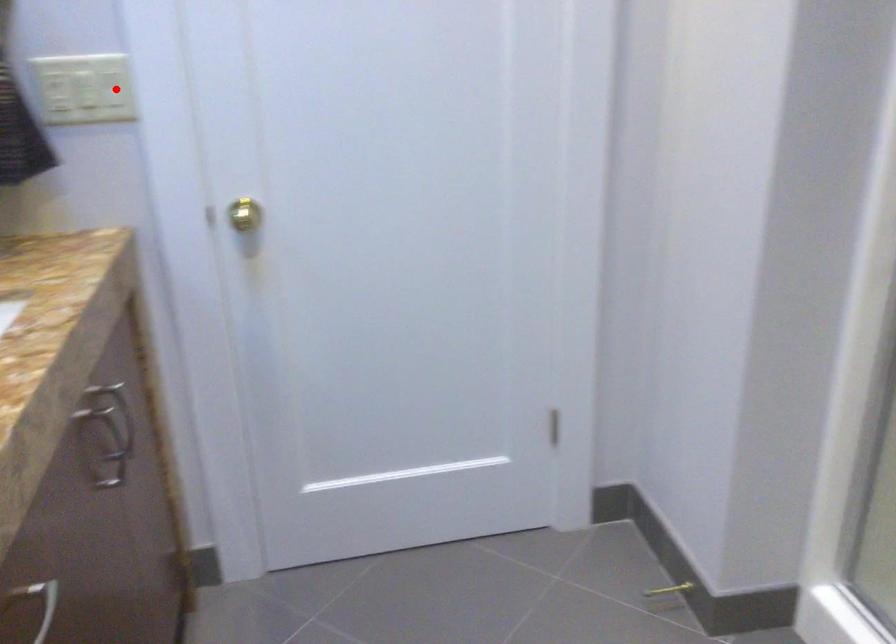
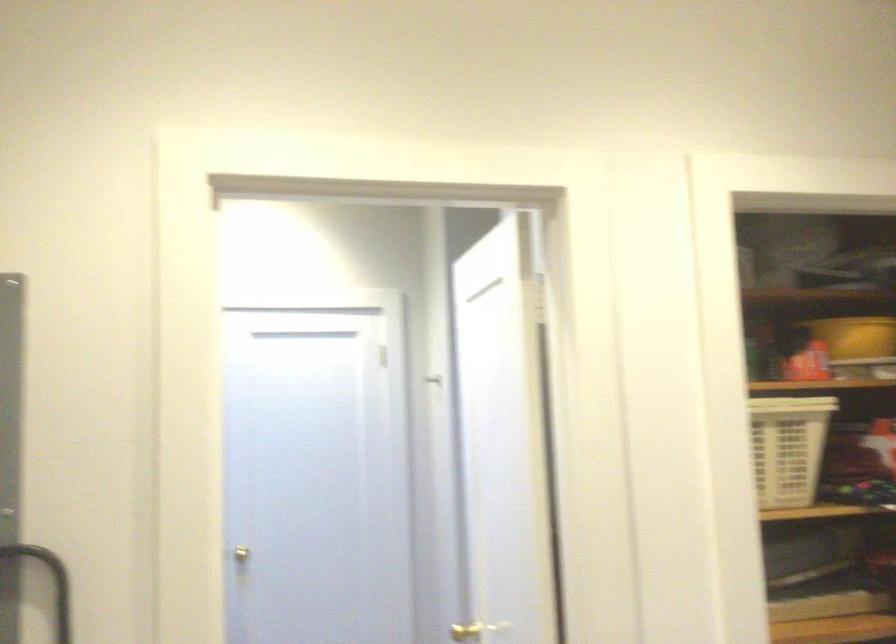
Question: I am providing you with two images of the same scene from different viewpoints. A red point is marked on the first image. At the location where the point appears in image 1, is it still visible in image 2?

Choices:
 (A) Yes
 (B) No

Answer: (B)